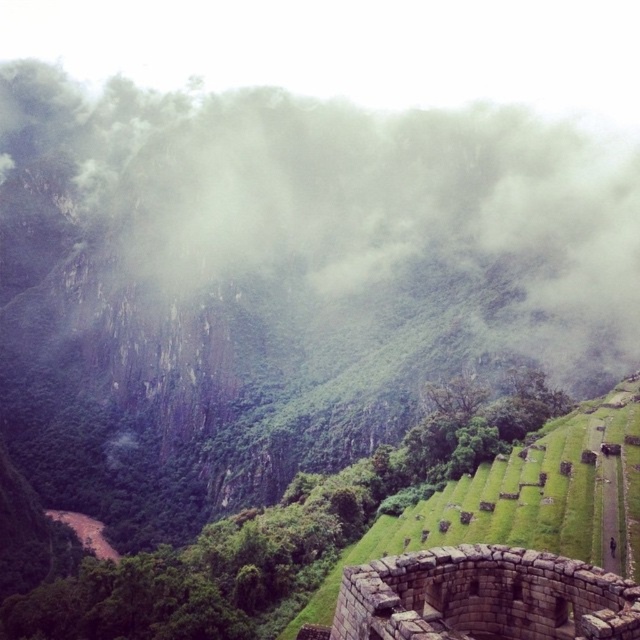
Question: Which point is closer to the camera taking this photo?

Choices:
 (A) (100, 257)
 (B) (579, 588)

Answer: (B)

Question: From the image, what is the correct spatial relationship of foggy misty mountain at upper center in relation to stone wall at lower right?

Choices:
 (A) right
 (B) left

Answer: (B)

Question: Is foggy misty mountain at upper center wider than stone wall at lower right?

Choices:
 (A) yes
 (B) no

Answer: (A)

Question: Does foggy misty mountain at upper center have a greater width compared to stone wall at lower right?

Choices:
 (A) no
 (B) yes

Answer: (B)

Question: Which object is closer to the camera taking this photo?

Choices:
 (A) stone wall at lower right
 (B) foggy misty mountain at upper center

Answer: (A)